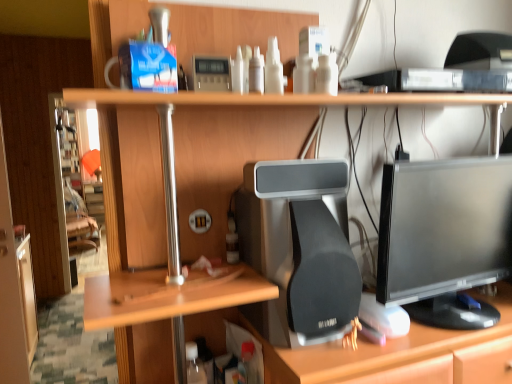
Question: Is point [x=275, y=365] closer or farther from the camera than point [x=509, y=175]?

Choices:
 (A) closer
 (B) farther

Answer: (A)

Question: From the image's perspective, is wooden desk at center above or below black glossy monitor at center right?

Choices:
 (A) below
 (B) above

Answer: (A)

Question: Which object is positioned farthest from the black glossy monitor at center right?

Choices:
 (A) wooden desk at center
 (B) matte black desktop computer at center

Answer: (A)

Question: Estimate the real-world distances between objects in this image. Which object is farther from the matte black desktop computer at center?

Choices:
 (A) wooden desk at center
 (B) black glossy monitor at center right

Answer: (A)